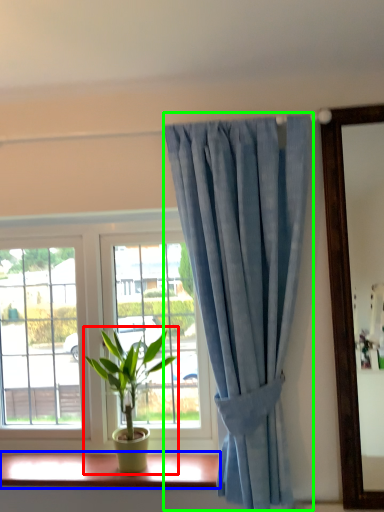
Question: Considering the real-world distances, which object is closest to houseplant (highlighted by a red box)? window sill (highlighted by a blue box) or curtain (highlighted by a green box).

Choices:
 (A) window sill
 (B) curtain

Answer: (A)